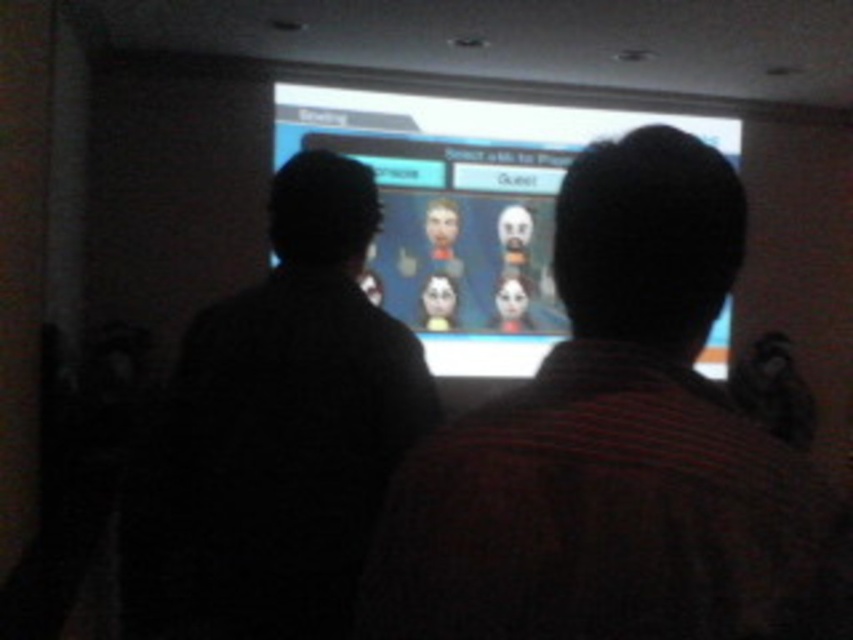
Question: Is striped fabric shirt at center above matte plastic screen at center?

Choices:
 (A) no
 (B) yes

Answer: (A)

Question: Estimate the real-world distances between objects in this image. Which object is farther from the black matte shirt at left?

Choices:
 (A) matte plastic screen at center
 (B) striped fabric shirt at center

Answer: (A)

Question: Which of the following is the farthest from the observer?

Choices:
 (A) striped fabric shirt at center
 (B) matte plastic screen at center

Answer: (B)

Question: Is striped fabric shirt at center in front of black matte shirt at left?

Choices:
 (A) no
 (B) yes

Answer: (B)

Question: Is striped fabric shirt at center closer to the viewer compared to matte plastic screen at center?

Choices:
 (A) no
 (B) yes

Answer: (B)

Question: Which point appears closest to the camera in this image?

Choices:
 (A) (280, 376)
 (B) (509, 348)
 (C) (444, 524)

Answer: (C)